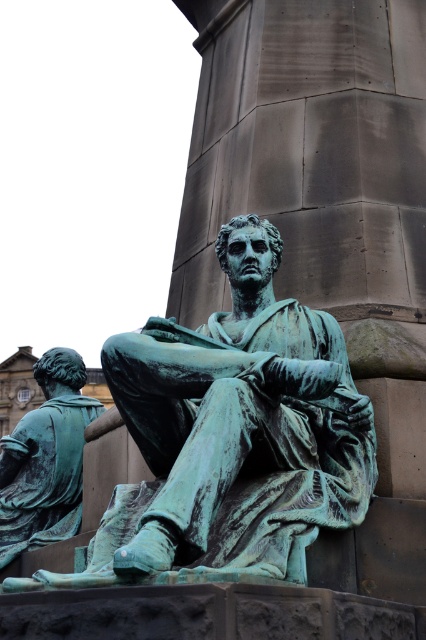
Is point (242, 420) closer to viewer compared to point (81, 456)?

Yes, point (242, 420) is in front of point (81, 456).

Can you confirm if green patina statue at center is smaller than green patina statue at lower left?

No.

Is point (270, 486) closer to camera compared to point (34, 445)?

Yes, it is in front of point (34, 445).

At what (x,y) coordinates should I click in order to perform the action: click on green patina statue at center. Please return your answer as a coordinate pair (x, y). The height and width of the screenshot is (640, 426). Looking at the image, I should click on (241, 422).